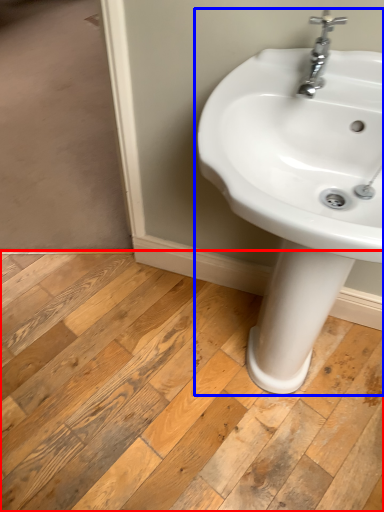
Question: Which of the following is the closest to the observer, plank (highlighted by a red box) or sink (highlighted by a blue box)?

Choices:
 (A) plank
 (B) sink

Answer: (B)